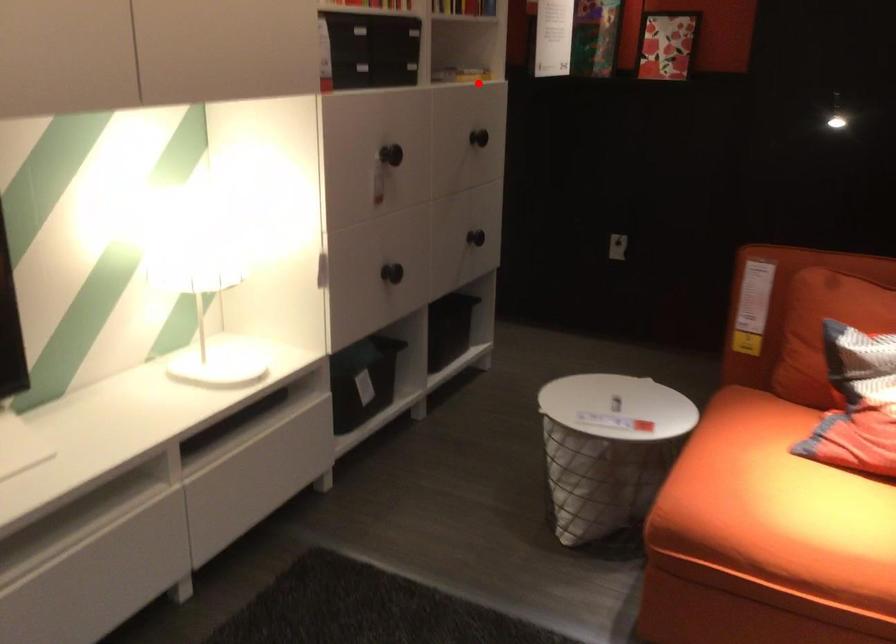
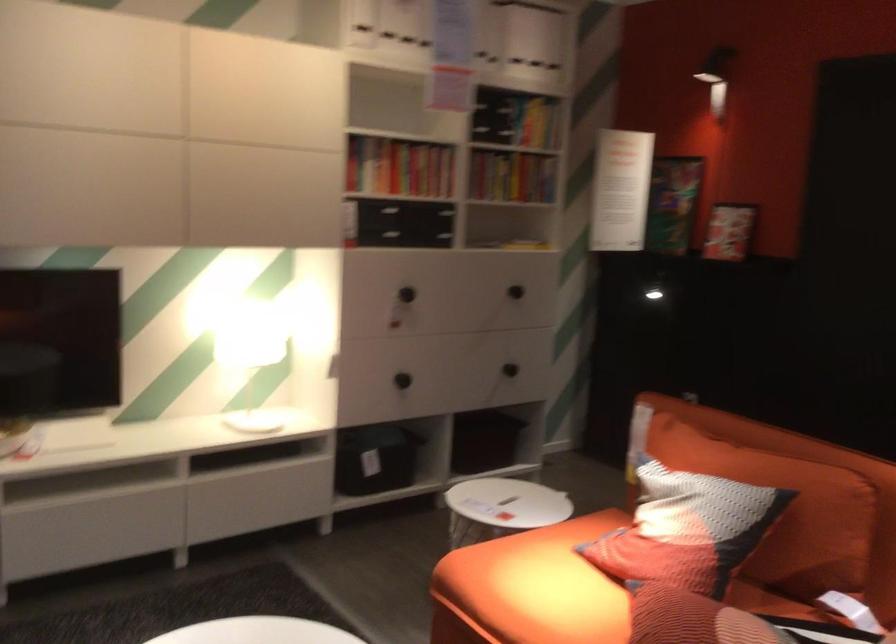
Question: I am providing you with two images of the same scene from different viewpoints. Given a red point in image1, look at the same physical point in image2. Is it:

Choices:
 (A) Closer to the viewpoint
 (B) Farther from the viewpoint

Answer: (B)